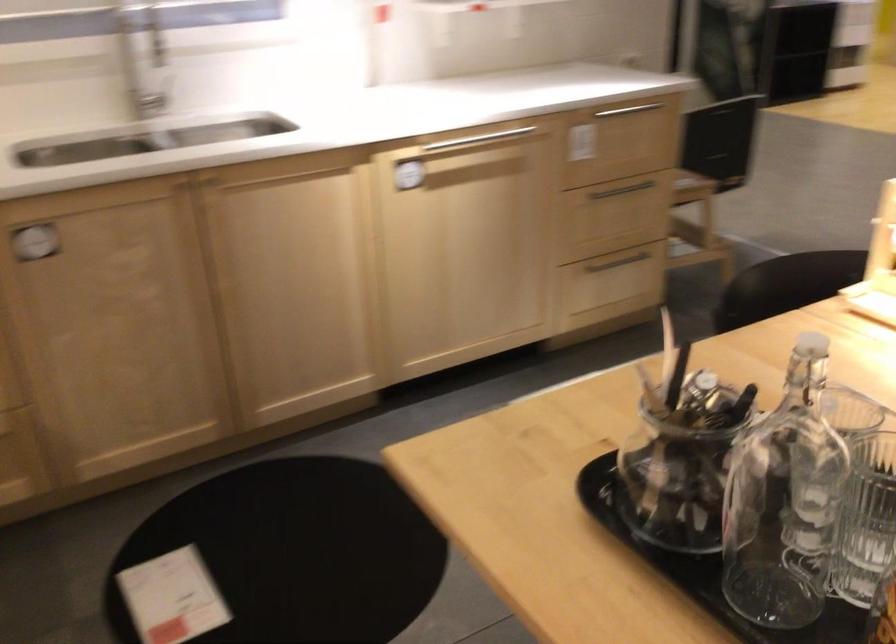
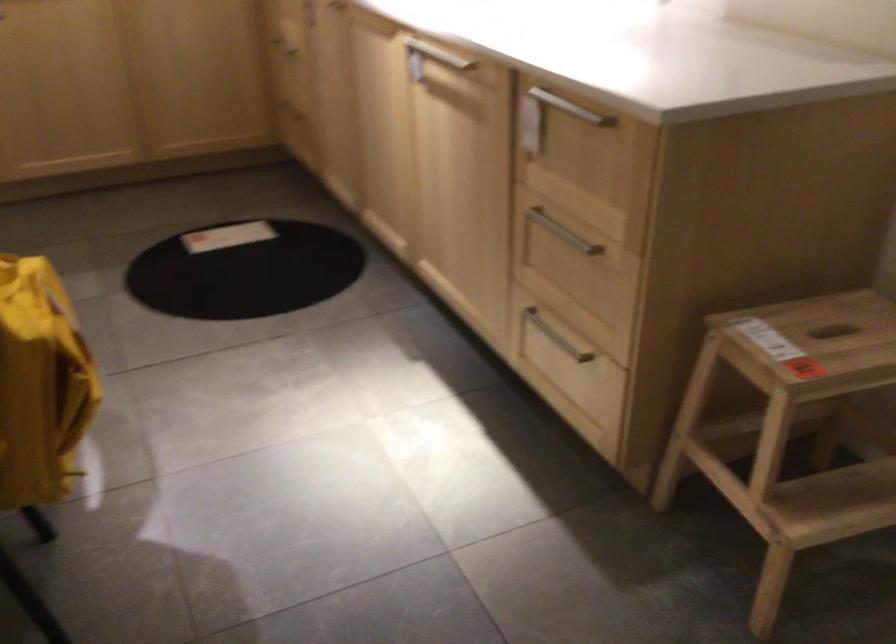
Find the pixel in the second image that matches (x=636, y=185) in the first image.

(563, 232)